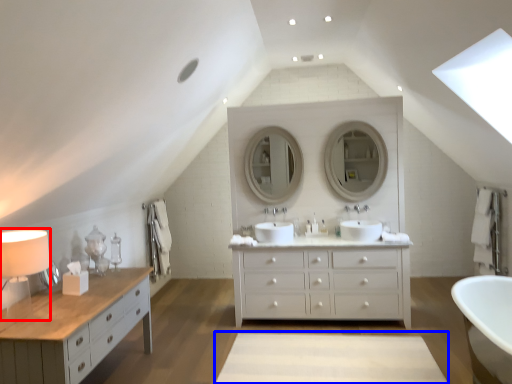
Question: Which object is further to the camera taking this photo, table lamp (highlighted by a red box) or plain (highlighted by a blue box)?

Choices:
 (A) table lamp
 (B) plain

Answer: (B)